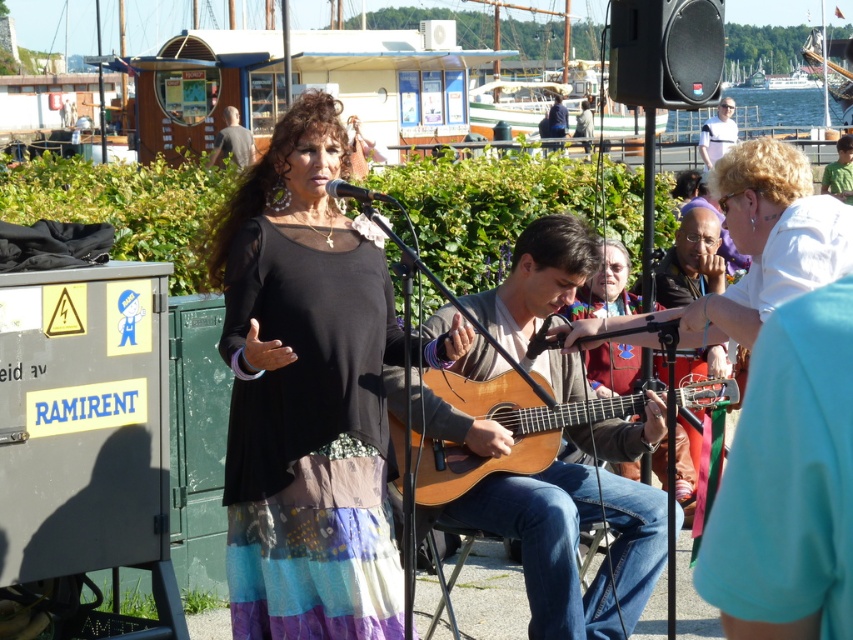
Can you confirm if clear water at upper right is shorter than gray fabric shirt at upper center?

No.

Is clear water at upper right below gray fabric shirt at upper center?

Incorrect, clear water at upper right is not positioned below gray fabric shirt at upper center.

At what (x,y) coordinates should I click in order to perform the action: click on clear water at upper right. Please return your answer as a coordinate pair (x, y). Looking at the image, I should click on (776, 106).

Where is `clear water at upper right`? The height and width of the screenshot is (640, 853). clear water at upper right is located at coordinates (776, 106).

Can you confirm if light brown wood guitar at center is positioned to the right of gray fabric shirt at upper center?

Correct, you'll find light brown wood guitar at center to the right of gray fabric shirt at upper center.

Is point (610, 433) less distant than point (254, 150)?

Yes, point (610, 433) is in front of point (254, 150).

This screenshot has width=853, height=640. What do you see at coordinates (572, 544) in the screenshot? I see `light brown wood guitar at center` at bounding box center [572, 544].

Find the location of `light brown wood guitar at center`. light brown wood guitar at center is located at coordinates (572, 544).

Which is behind, point (544, 432) or point (250, 156)?

The point (250, 156) is more distant.

Which is below, wooden acoustic guitar at center or gray fabric shirt at upper center?

wooden acoustic guitar at center is lower down.

Locate an element on the screen. wooden acoustic guitar at center is located at coordinates (502, 424).

This screenshot has width=853, height=640. In order to click on wooden acoustic guitar at center in this screenshot , I will do `click(502, 424)`.